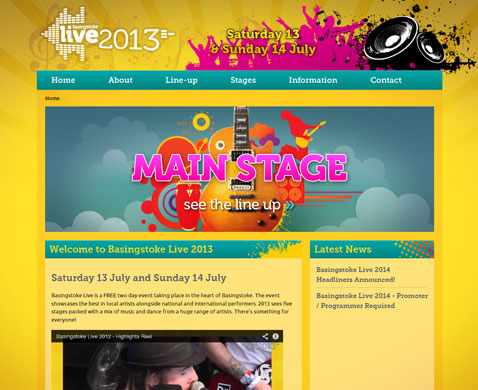
At what (x,y) coordinates should I click in order to perform the action: click on speakers. Please return your answer as a coordinate pair (x, y). This screenshot has width=478, height=390. Looking at the image, I should click on (400, 44), (425, 51).